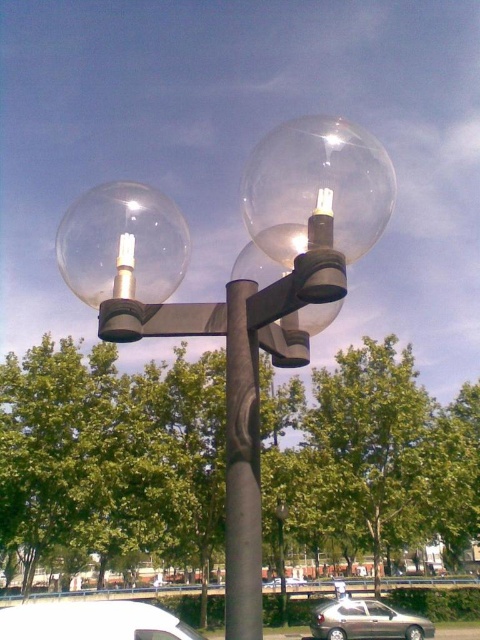
Question: In this image, where is transparent glass globe at left located relative to white matte van at lower left?

Choices:
 (A) above
 (B) below

Answer: (A)

Question: Is the position of white matte van at lower left more distant than that of silver metallic car at center?

Choices:
 (A) yes
 (B) no

Answer: (B)

Question: Considering the real-world distances, which object is farthest from the metallic gold car at lower center?

Choices:
 (A) white matte van at lower left
 (B) transparent glass globe at left

Answer: (B)

Question: Which point appears farthest from the camera in this image?

Choices:
 (A) (342, 604)
 (B) (81, 248)
 (C) (133, 240)

Answer: (A)

Question: Which point is closer to the camera?

Choices:
 (A) metallic gold car at lower center
 (B) white matte van at lower left

Answer: (B)

Question: Is black matte pole at center closer to camera compared to white matte van at lower left?

Choices:
 (A) yes
 (B) no

Answer: (A)